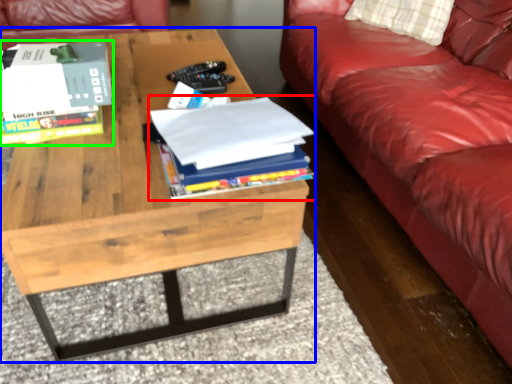
Question: Which object is the closest to the book (highlighted by a red box)? Choose among these: coffee table (highlighted by a blue box) or book (highlighted by a green box).

Choices:
 (A) coffee table
 (B) book

Answer: (A)